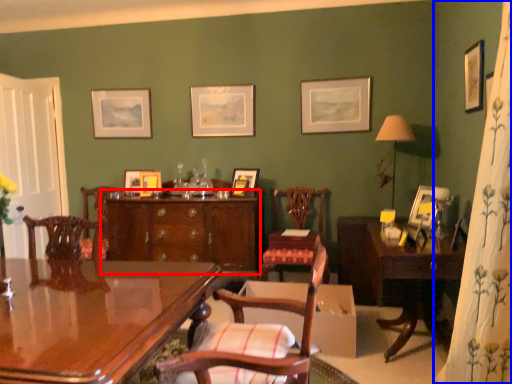
Question: Among these objects, which one is farthest to the camera, cabinetry (highlighted by a red box) or curtain (highlighted by a blue box)?

Choices:
 (A) cabinetry
 (B) curtain

Answer: (A)